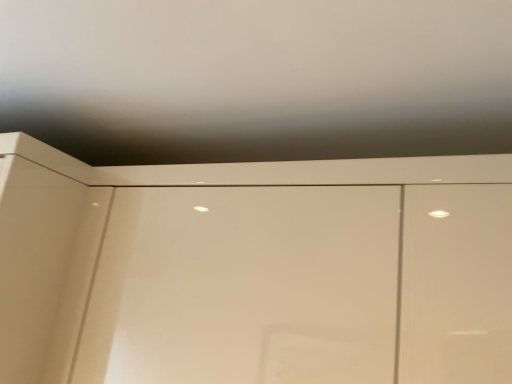
What do you see at coordinates (254, 270) in the screenshot?
I see `white glossy cupboard at center` at bounding box center [254, 270].

Measure the distance between white glossy cupboard at center and camera.

The depth of white glossy cupboard at center is 47.64 centimeters.

This screenshot has width=512, height=384. I want to click on white glossy cupboard at center, so click(254, 270).

Find the location of a particular element. white glossy cupboard at center is located at coordinates (254, 270).